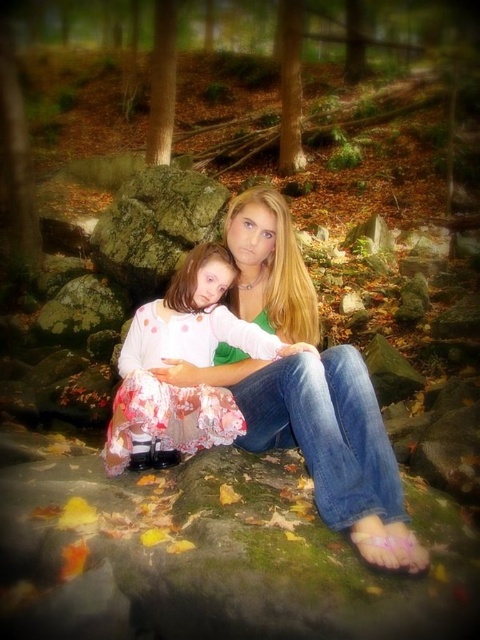
You are planning to place a picnic basket on the green mossy rock at center and a water bottle on the green mossy rock at left. Considering their sizes, which object can accommodate a larger item?

The green mossy rock at center can accommodate a larger item because its width is larger than the green mossy rock at left.

You are planning to place a small picnic basket between the matte green blouse at center and the green mossy rock at center. Given their sizes, will the basket fit comfortably between them?

The matte green blouse at center is narrower than the green mossy rock at center, so placing a small picnic basket between them should be possible as there is enough space.

You are standing in the forest and want to sit on the green mossy rock at center. To reach it, you must walk past the green mossy rock at left. Which rock should you step on first?

You should step on the green mossy rock at left first because the green mossy rock at center is closer to you, so the green mossy rock at left is farther away and you need to step on it first to reach the closer one.